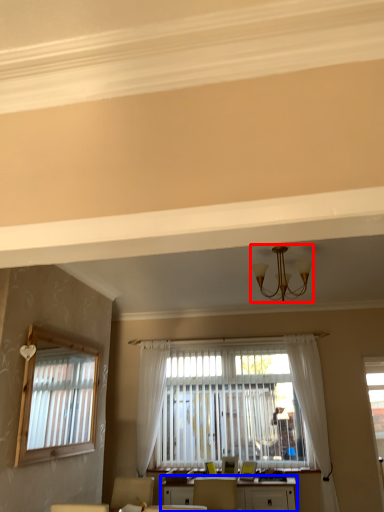
Question: Which object appears closest to the camera in this image, light fixture (highlighted by a red box) or table (highlighted by a blue box)?

Choices:
 (A) light fixture
 (B) table

Answer: (A)